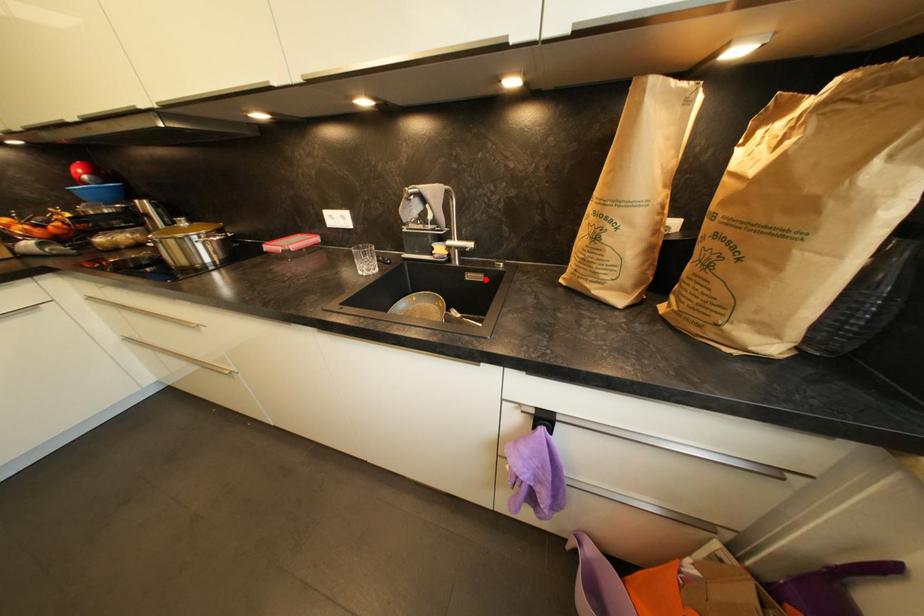
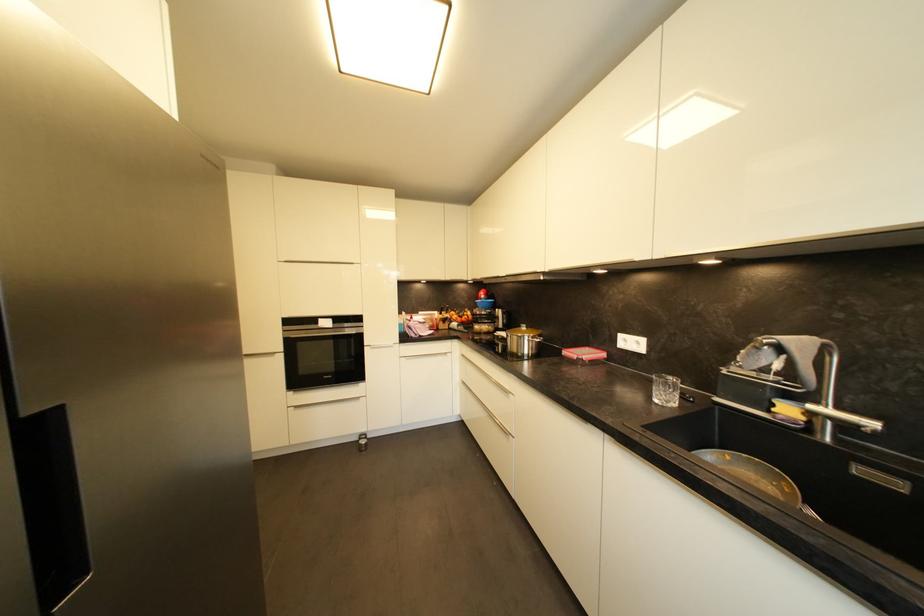
Question: I am providing you with two images of the same scene from different viewpoints. A red point is marked on the first image. Is the red point's position out of view in image 2?

Choices:
 (A) Yes
 (B) No

Answer: (B)